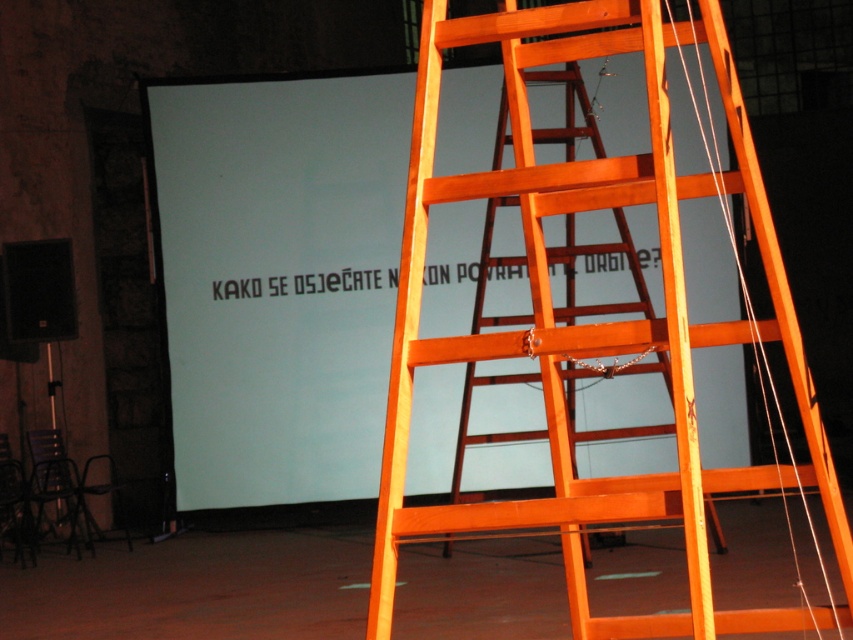
Based on the photo, you are standing at the camera position and want to reach the white matte projection screen at upper left. The ladder in front of you is 10 feet long. Can you use the ladder to reach the screen?

The white matte projection screen at upper left is 37.11 feet from the camera. Since the ladder is only 10 feet long, it is not long enough to reach the screen.

You are an event organizer setting up for a presentation. You have two orange ladders in front of you. The first is labeled as the orange wood ladder at center, and the second is the orange wooden ladder at center. You need to choose the wider ladder to place near the projection screen. Which ladder should you choose?

The orange wood ladder at center is wider than the orange wooden ladder at center, so you should choose the orange wood ladder at center for placement near the projection screen.

Looking at this image, you are an event organizer setting up for a presentation. You have a white matte projection screen at upper left and an orange wood ladder at center. Which object is located to the left of the other?

The white matte projection screen at upper left is positioned on the left side of orange wood ladder at center.